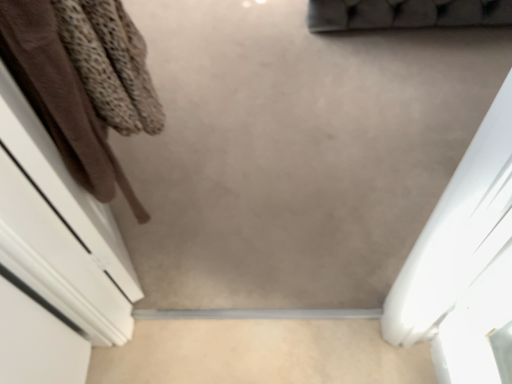
Question: Does beige matte concrete at center have a lesser height compared to brown fabric at left?

Choices:
 (A) yes
 (B) no

Answer: (A)

Question: Does beige matte concrete at center have a smaller size compared to brown fabric at left?

Choices:
 (A) yes
 (B) no

Answer: (A)

Question: Would you say brown fabric at left is part of beige matte concrete at center's contents?

Choices:
 (A) no
 (B) yes

Answer: (A)

Question: Considering the relative sizes of beige matte concrete at center and brown fabric at left in the image provided, is beige matte concrete at center wider than brown fabric at left?

Choices:
 (A) yes
 (B) no

Answer: (A)

Question: From the image's perspective, is beige matte concrete at center under brown fabric at left?

Choices:
 (A) yes
 (B) no

Answer: (A)

Question: Considering the relative positions of beige matte concrete at center and brown fabric at left in the image provided, is beige matte concrete at center to the left of brown fabric at left from the viewer's perspective?

Choices:
 (A) yes
 (B) no

Answer: (B)

Question: Can you confirm if brown fabric at left is smaller than beige matte concrete at center?

Choices:
 (A) no
 (B) yes

Answer: (A)

Question: Is brown fabric at left not close to beige matte concrete at center?

Choices:
 (A) no
 (B) yes

Answer: (A)

Question: Is brown fabric at left not inside beige matte concrete at center?

Choices:
 (A) yes
 (B) no

Answer: (A)

Question: Considering the relative sizes of brown fabric at left and beige matte concrete at center in the image provided, is brown fabric at left bigger than beige matte concrete at center?

Choices:
 (A) no
 (B) yes

Answer: (B)

Question: Is brown fabric at left aimed at beige matte concrete at center?

Choices:
 (A) yes
 (B) no

Answer: (B)

Question: Considering the relative sizes of brown fabric at left and beige matte concrete at center in the image provided, is brown fabric at left wider than beige matte concrete at center?

Choices:
 (A) no
 (B) yes

Answer: (A)

Question: Visually, is beige matte concrete at center positioned to the left or to the right of brown fabric at left?

Choices:
 (A) left
 (B) right

Answer: (B)